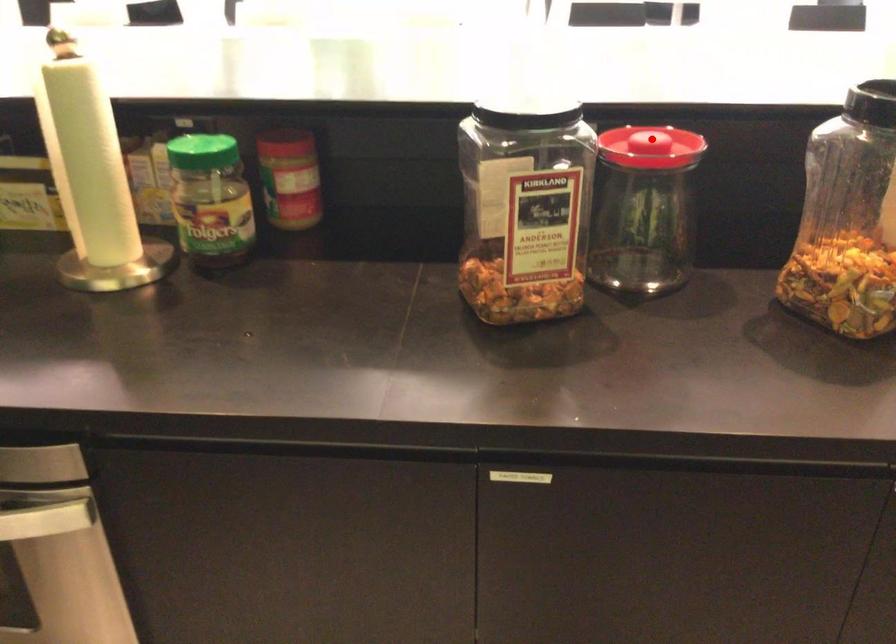
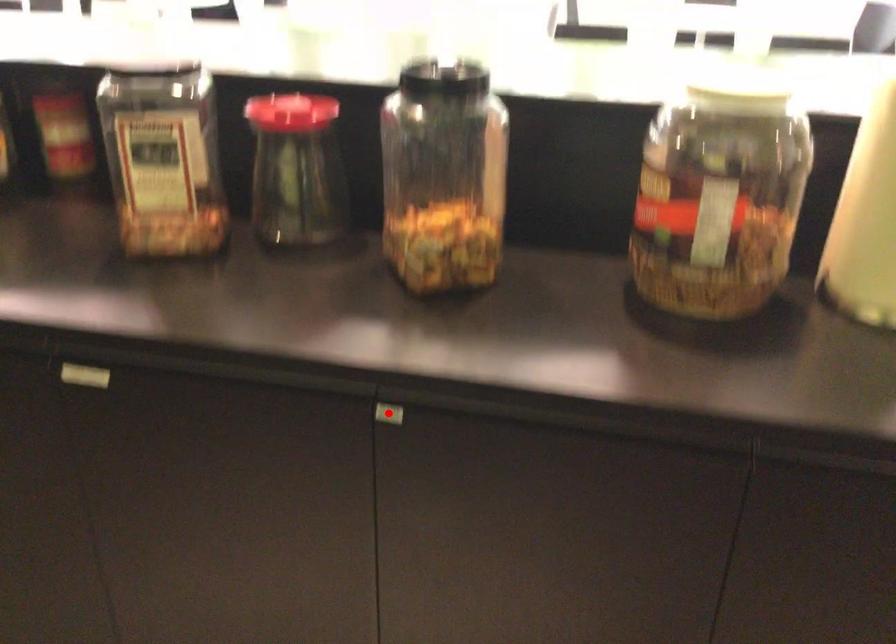
I am providing you with two images of the same scene from different viewpoints. A red point is marked on the first image and another point is marked on the second image. Do the highlighted points in image1 and image2 indicate the same real-world spot?

No